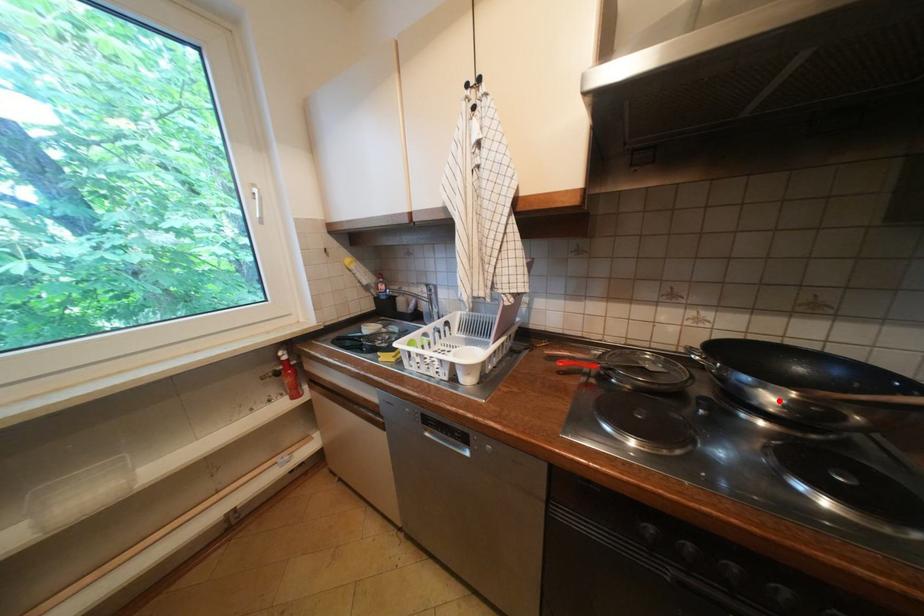
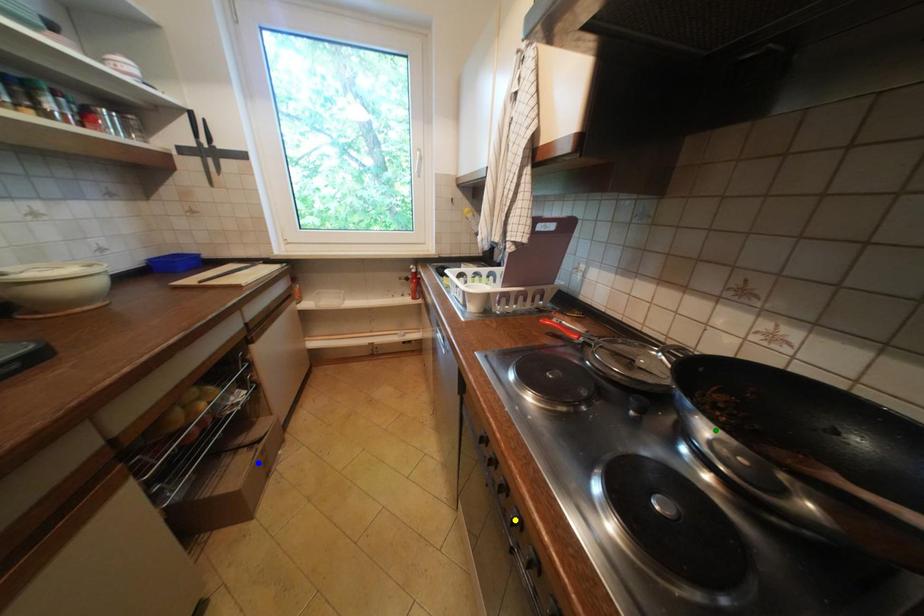
Question: I am providing you with two images of the same scene from different viewpoints. A red point is marked on the first image. You are given multiple points on the second image. Which mark in image 2 goes with the point in image 1?

Choices:
 (A) blue point
 (B) yellow point
 (C) green point

Answer: (C)